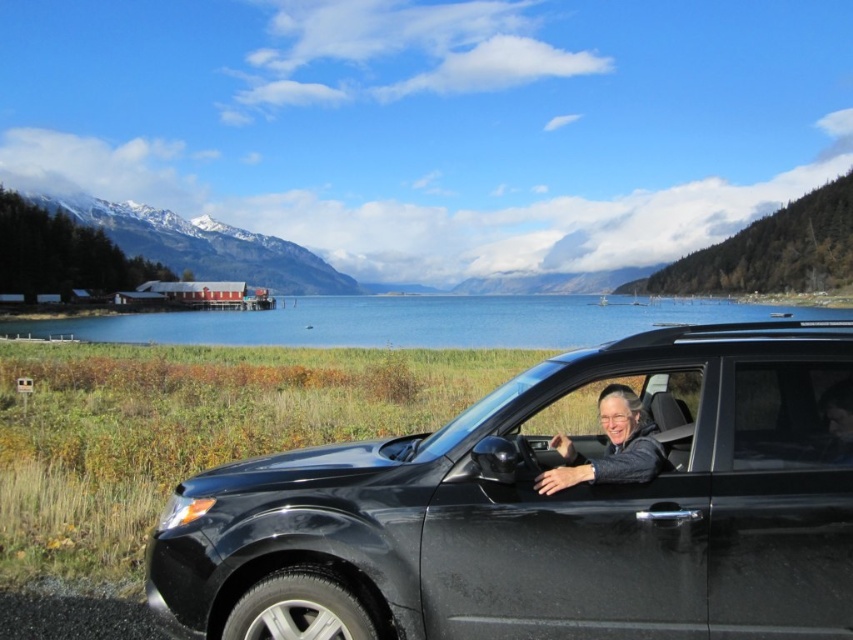
Question: Estimate the real-world distances between objects in this image. Which object is closer to the glossy black suv at lower right?

Choices:
 (A) blue water at center
 (B) transparent glass window at center
 (C) matte gray car door at center

Answer: (B)

Question: Does glossy black suv at lower right appear on the left side of matte gray car door at center?

Choices:
 (A) no
 (B) yes

Answer: (B)

Question: Among these objects, which one is nearest to the camera?

Choices:
 (A) transparent glass window at center
 (B) glossy black suv at lower right

Answer: (B)

Question: Does glossy black suv at lower right have a smaller size compared to matte gray car door at center?

Choices:
 (A) no
 (B) yes

Answer: (A)

Question: Which object is farther from the camera taking this photo?

Choices:
 (A) transparent glass window at center
 (B) blue water at center
 (C) glossy black suv at lower right
 (D) matte gray car door at center

Answer: (B)

Question: Is blue water at center thinner than transparent glass window at center?

Choices:
 (A) yes
 (B) no

Answer: (B)